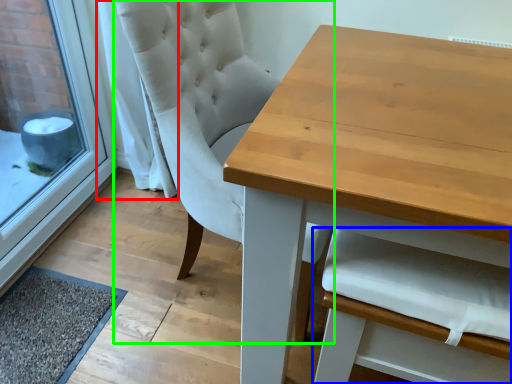
Question: Which object is positioned closest to curtain (highlighted by a red box)? Select from armchair (highlighted by a blue box) and chair (highlighted by a green box).

Choices:
 (A) armchair
 (B) chair

Answer: (B)